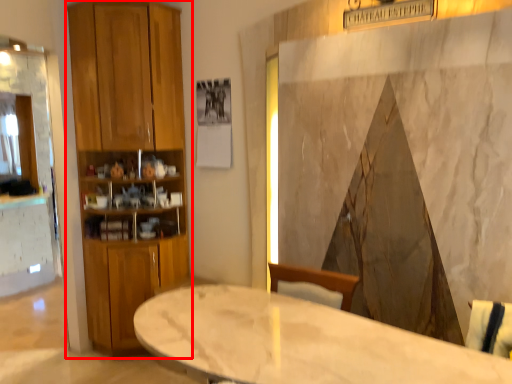
Question: From the image's perspective, considering the relative positions of closet (annotated by the red box) and table in the image provided, where is closet (annotated by the red box) located with respect to the staircase?

Choices:
 (A) above
 (B) below

Answer: (A)